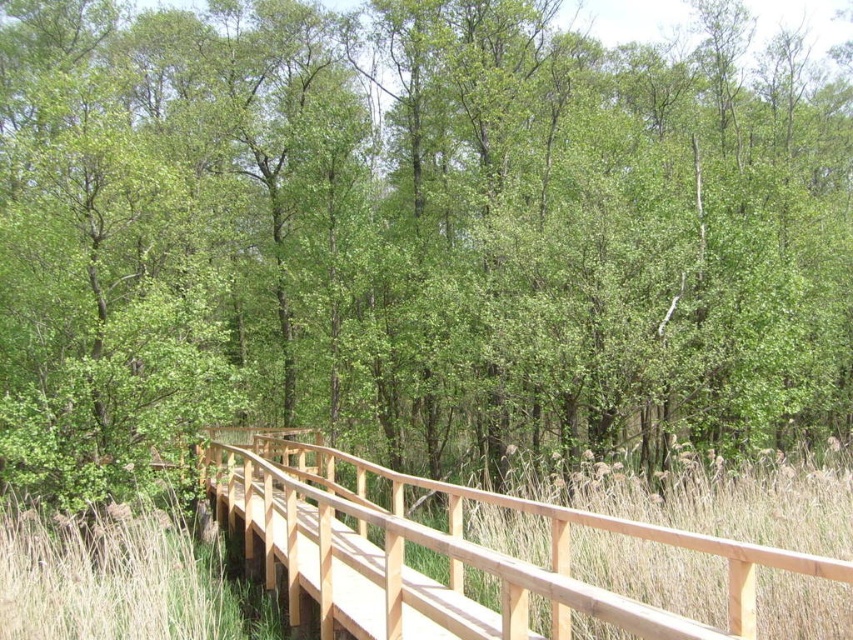
Where is `natural wood bridge at center`? The width and height of the screenshot is (853, 640). natural wood bridge at center is located at coordinates (447, 554).

Who is more distant from viewer, (508, 570) or (85, 563)?

The point (85, 563) is behind.

I want to click on natural wood bridge at center, so click(447, 554).